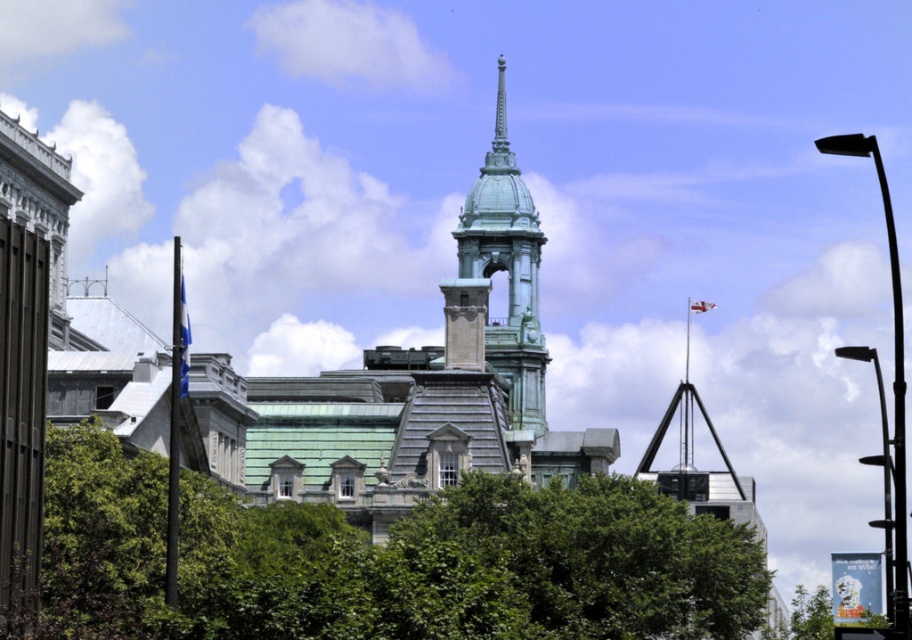
Is green leafy tree at center positioned behind green patina bell tower at center?

No, it is in front of green patina bell tower at center.

What do you see at coordinates (382, 561) in the screenshot? I see `green leafy tree at center` at bounding box center [382, 561].

You are a GUI agent. You are given a task and a screenshot of the screen. Output one action in this format:
    pyautogui.click(x=<x>, y=<y>)
    Task: Click on the green leafy tree at center
    
    Given the screenshot: What is the action you would take?
    pyautogui.click(x=382, y=561)